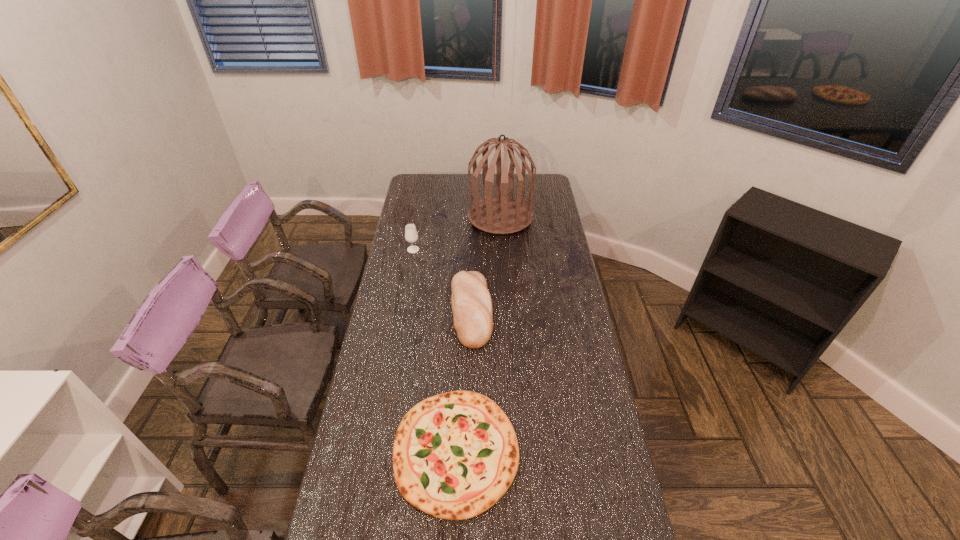
At what (x,y) coordinates should I click in order to perform the action: click on the farthest object. Please return your answer as a coordinate pair (x, y). The width and height of the screenshot is (960, 540). Looking at the image, I should click on (502, 215).

Locate an element on the screen. Image resolution: width=960 pixels, height=540 pixels. the tallest object is located at coordinates (502, 215).

You are a GUI agent. You are given a task and a screenshot of the screen. Output one action in this format:
    pyautogui.click(x=<x>, y=<y>)
    Task: Click on the second tallest object
    The image size is (960, 540).
    Given the screenshot: What is the action you would take?
    pyautogui.click(x=411, y=235)

The width and height of the screenshot is (960, 540). What are the coordinates of `glass` in the screenshot? It's located at (411, 235).

Identify the location of bread. This screenshot has height=540, width=960. (471, 301).

What are the coordinates of `the second shortest object` in the screenshot? It's located at (471, 301).

Locate an element on the screen. This screenshot has height=540, width=960. the shortest object is located at coordinates (455, 454).

Find the location of a particular element. pizza is located at coordinates click(x=455, y=454).

This screenshot has width=960, height=540. Find the location of `vacant point located on the left of the farthest object`. vacant point located on the left of the farthest object is located at coordinates (423, 217).

At what (x,y) coordinates should I click in order to perform the action: click on free space located 0.230m on the front of the second farthest object. Please return your answer as a coordinate pair (x, y). The height and width of the screenshot is (540, 960). Looking at the image, I should click on (406, 288).